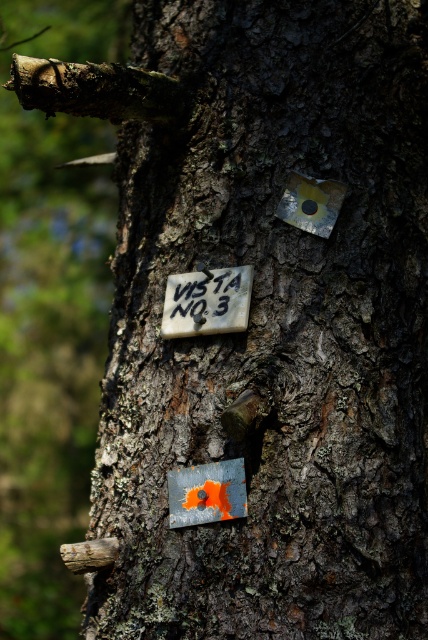
How much distance is there between white paper at center and orange painted metal sign at center?

They are 7.55 inches apart.

Who is more distant from viewer, (x=211, y=284) or (x=214, y=512)?

Point (x=211, y=284)

Image resolution: width=428 pixels, height=640 pixels. In order to click on white paper at center in this screenshot , I will do `click(207, 301)`.